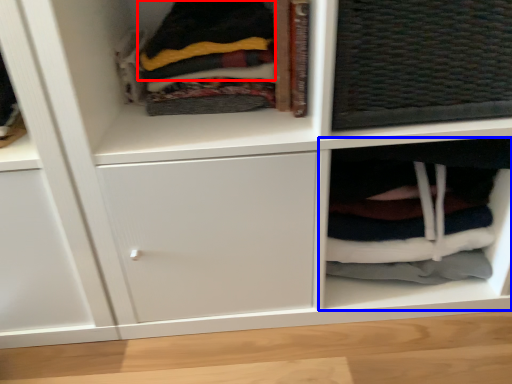
Question: Which of the following is the closest to the observer, clothing (highlighted by a red box) or cabinet (highlighted by a blue box)?

Choices:
 (A) clothing
 (B) cabinet

Answer: (A)